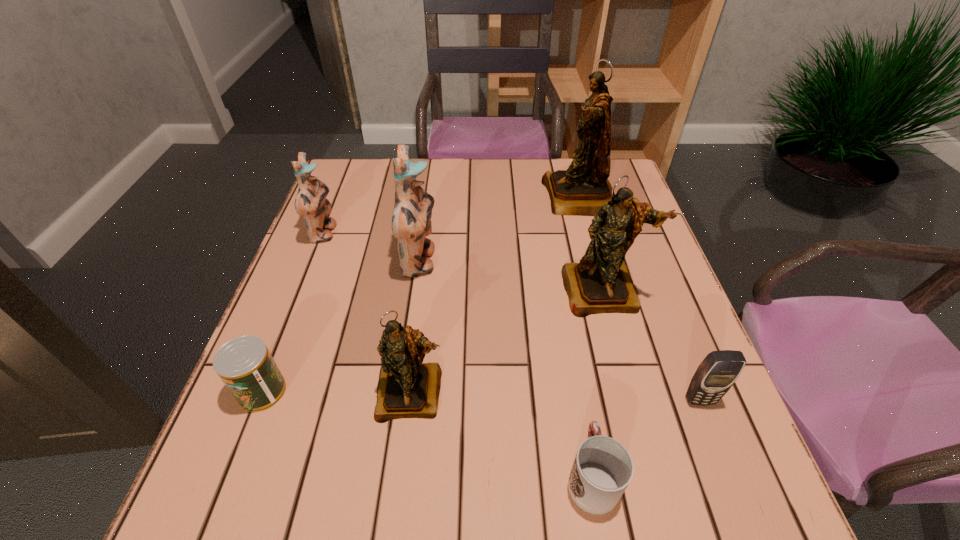
Identify the location of the farthest gold figurine. The image size is (960, 540). (581, 190).

Where is `the biggest gold figurine`? The width and height of the screenshot is (960, 540). the biggest gold figurine is located at coordinates (581, 190).

Identify the location of the right pink figurine. (411, 219).

Locate an element on the screen. This screenshot has width=960, height=540. the second nearest gold figurine is located at coordinates (601, 283).

Where is `the left pink figurine`? This screenshot has width=960, height=540. the left pink figurine is located at coordinates (311, 201).

Identify the location of the smaller pink figurine. Image resolution: width=960 pixels, height=540 pixels. (311, 201).

Identify the location of the smallest gold figurine. The width and height of the screenshot is (960, 540). (407, 388).

What are the coordinates of `the nearest figurine` in the screenshot? It's located at (407, 388).

The width and height of the screenshot is (960, 540). Find the location of `the sixth tallest object`. the sixth tallest object is located at coordinates (716, 374).

Where is `can`? The image size is (960, 540). can is located at coordinates (245, 365).